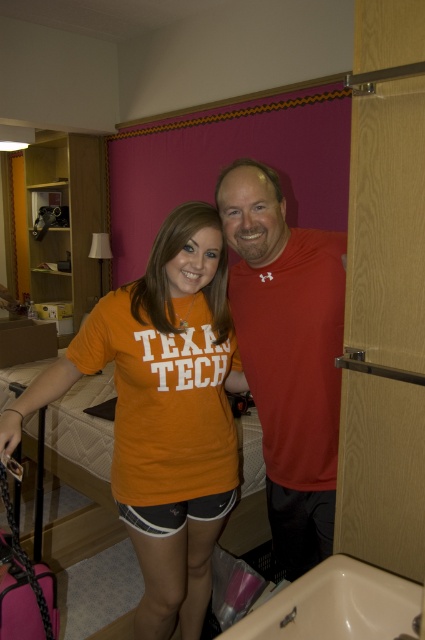
Question: Is orange cotton t-shirt at center positioned behind matte red t-shirt at center?

Choices:
 (A) yes
 (B) no

Answer: (B)

Question: Is orange cotton t-shirt at center positioned in front of matte red t-shirt at center?

Choices:
 (A) yes
 (B) no

Answer: (A)

Question: Which object is closer to the camera taking this photo?

Choices:
 (A) orange cotton t-shirt at center
 (B) matte red t-shirt at center

Answer: (A)

Question: Is orange cotton t-shirt at center thinner than matte red t-shirt at center?

Choices:
 (A) yes
 (B) no

Answer: (B)